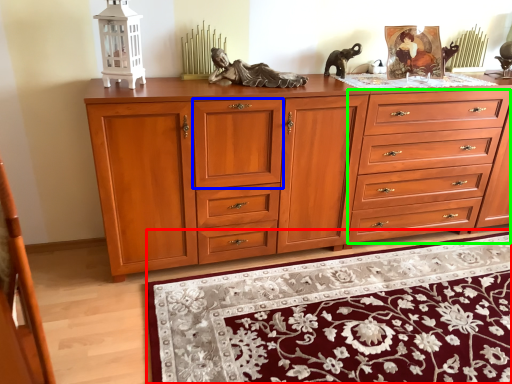
Question: Estimate the real-world distances between objects in this image. Which object is farther from mat (highlighted by a red box), drawer (highlighted by a blue box) or drawer (highlighted by a green box)?

Choices:
 (A) drawer
 (B) drawer

Answer: (A)